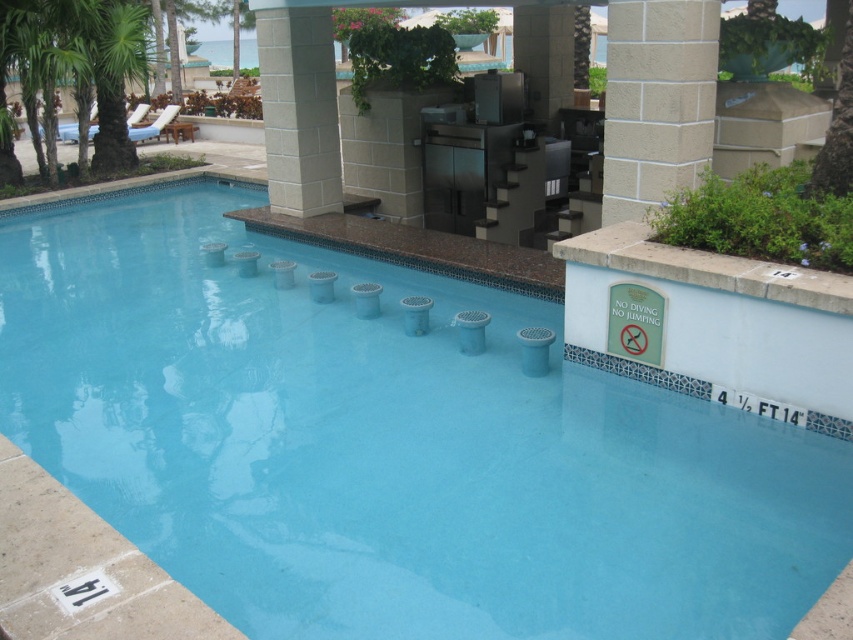
Is clear blue water at center below beige stone pillar at center?

Yes.

I want to click on clear blue water at center, so click(x=387, y=449).

Is white textured pillar at upper center shorter than beige stone pillar at center?

Yes, white textured pillar at upper center is shorter than beige stone pillar at center.

Does point (648, 20) come in front of point (294, 38)?

That is True.

Between point (701, 83) and point (309, 141), which one is positioned in front?

Point (701, 83)

Locate an element on the screen. white textured pillar at upper center is located at coordinates (657, 100).

I want to click on clear blue water at center, so click(x=387, y=449).

Who is positioned more to the right, clear blue water at center or white textured pillar at upper center?

white textured pillar at upper center is more to the right.

The width and height of the screenshot is (853, 640). What do you see at coordinates (387, 449) in the screenshot?
I see `clear blue water at center` at bounding box center [387, 449].

Where is `clear blue water at center`? clear blue water at center is located at coordinates (387, 449).